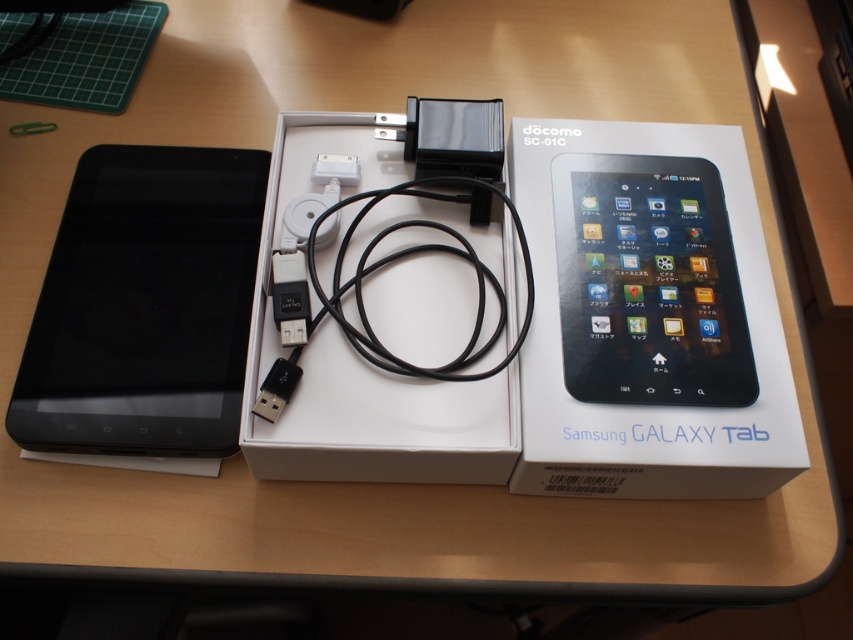
Question: Is white matte samsung galaxy tab box at center positioned at the back of black matte tablet at left?

Choices:
 (A) yes
 (B) no

Answer: (B)

Question: Is black matte tablet at left positioned at the back of black plastic usb plug at center?

Choices:
 (A) no
 (B) yes

Answer: (B)

Question: Which of the following is the farthest from the observer?

Choices:
 (A) (717, 324)
 (B) (364, 305)
 (C) (645, 211)
 (D) (291, 310)

Answer: (C)

Question: Can you confirm if white matte box at center is positioned to the left of black glossy tablet at upper center?

Choices:
 (A) no
 (B) yes

Answer: (B)

Question: Which object is farther from the camera taking this photo?

Choices:
 (A) white matte box at center
 (B) white matte samsung galaxy tab box at center

Answer: (B)

Question: Which point is closer to the camera taking this photo?

Choices:
 (A) (181, 362)
 (B) (308, 317)

Answer: (B)